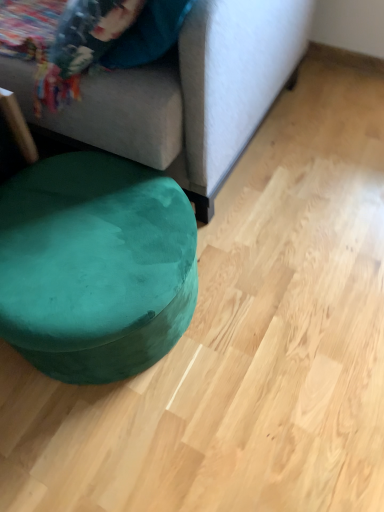
Identify the location of empty space that is ontop of velvet green bean bag at lower left (from a real-world perspective). Image resolution: width=384 pixels, height=512 pixels. (86, 229).